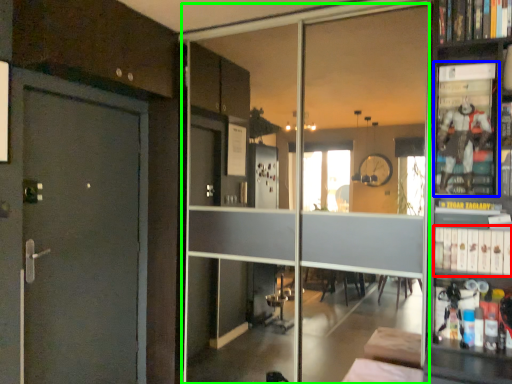
Question: Which is farther away from book (highlighted by a red box)? shelf (highlighted by a blue box) or glass door (highlighted by a green box)?

Choices:
 (A) shelf
 (B) glass door

Answer: (B)